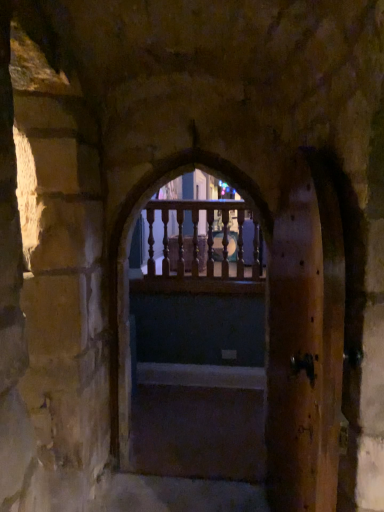
What do you see at coordinates (200, 234) in the screenshot?
I see `transparent wooden railing at center` at bounding box center [200, 234].

The height and width of the screenshot is (512, 384). What do you see at coordinates (198, 422) in the screenshot? I see `dark wood stairs at center` at bounding box center [198, 422].

What is the approximate width of brown wooden screen door at right?

It is 10.09 inches.

Identify the location of brown wooden screen door at right. (305, 342).

Where is `transparent wooden railing at center`? The image size is (384, 512). transparent wooden railing at center is located at coordinates (200, 234).

From the image's perspective, is wooden railing at center located above or below dark wood stairs at center?

Clearly, from the image's perspective, wooden railing at center is above dark wood stairs at center.

Between wooden railing at center and dark wood stairs at center, which one has less height?

dark wood stairs at center.

Is point (160, 440) closer or farther from the camera than point (244, 429)?

Point (160, 440) appears to be closer to the viewer than point (244, 429).

Looking at this image, considering the sizes of objects wooden railing at center and dark wood stairs at center in the image provided, who is wider, wooden railing at center or dark wood stairs at center?

dark wood stairs at center.

Which is behind, transparent wooden railing at center or brown wooden screen door at right?

transparent wooden railing at center is further from the camera.

Can you tell me how much transparent wooden railing at center and brown wooden screen door at right differ in facing direction?

The angular difference between transparent wooden railing at center and brown wooden screen door at right is 85 degrees.

From the picture: Can you confirm if transparent wooden railing at center is thinner than brown wooden screen door at right?

Correct, the width of transparent wooden railing at center is less than that of brown wooden screen door at right.

From the image's perspective, is transparent wooden railing at center under brown wooden screen door at right?

Actually, transparent wooden railing at center appears above brown wooden screen door at right in the image.

Is dark wood stairs at center inside or outside of wooden railing at center?

The correct answer is: outside.

The width and height of the screenshot is (384, 512). Find the location of `stairs behind the wooden railing at center`. stairs behind the wooden railing at center is located at coordinates (198, 422).

Is dark wood stairs at center not near wooden railing at center?

No, dark wood stairs at center is not far away from wooden railing at center.

Is dark wood stairs at center positioned with its back to wooden railing at center?

dark wood stairs at center does not have its back to wooden railing at center.

Is wooden railing at center completely or partially inside transparent wooden railing at center?

No, wooden railing at center is not inside transparent wooden railing at center.

Between transparent wooden railing at center and wooden railing at center, which one has larger width?

Wider between the two is wooden railing at center.

Is transparent wooden railing at center oriented away from wooden railing at center?

No, transparent wooden railing at center is not facing the opposite direction of wooden railing at center.

I want to click on glass window lying on the left of wooden railing at center, so click(x=200, y=234).

Is transparent wooden railing at center at the back of brown wooden screen door at right?

No.

From the image's perspective, between brown wooden screen door at right and transparent wooden railing at center, which one is located above?

From the image's view, transparent wooden railing at center is above.

Between brown wooden screen door at right and transparent wooden railing at center, which one has smaller width?

transparent wooden railing at center is thinner.

Is brown wooden screen door at right with transparent wooden railing at center?

No, brown wooden screen door at right is not next to transparent wooden railing at center.

From a real-world perspective, is brown wooden screen door at right over wooden railing at center?

No.

Considering the sizes of brown wooden screen door at right and wooden railing at center in the image, is brown wooden screen door at right taller or shorter than wooden railing at center?

brown wooden screen door at right is shorter than wooden railing at center.

Which object is closer to the camera, brown wooden screen door at right or wooden railing at center?

Positioned in front is brown wooden screen door at right.

In the scene shown: How different are the orientations of brown wooden screen door at right and wooden railing at center in degrees?

brown wooden screen door at right and wooden railing at center are facing 82.7 degrees away from each other.

Which is closer to the camera, (205, 230) or (162, 373)?

The point (205, 230) is closer to the camera.

Are transparent wooden railing at center and dark wood stairs at center located far from each other?

Indeed, transparent wooden railing at center is not near dark wood stairs at center.

Considering the sizes of transparent wooden railing at center and dark wood stairs at center in the image, is transparent wooden railing at center taller or shorter than dark wood stairs at center?

Considering their sizes, transparent wooden railing at center has more height than dark wood stairs at center.

Considering the sizes of objects transparent wooden railing at center and dark wood stairs at center in the image provided, who is smaller, transparent wooden railing at center or dark wood stairs at center?

With smaller size is dark wood stairs at center.

Where is `stairs below the wooden railing at center (from the image's perspective)`? stairs below the wooden railing at center (from the image's perspective) is located at coordinates (198, 422).

This screenshot has height=512, width=384. I want to click on screen door that is on the right side of transparent wooden railing at center, so click(305, 342).

Which object lies further to the anchor point dark wood stairs at center, wooden railing at center or transparent wooden railing at center?

transparent wooden railing at center lies further to dark wood stairs at center than the other object.

When comparing their distances from brown wooden screen door at right, does wooden railing at center or transparent wooden railing at center seem further?

The object further to brown wooden screen door at right is transparent wooden railing at center.

Based on their spatial positions, is transparent wooden railing at center or wooden railing at center closer to brown wooden screen door at right?

wooden railing at center lies closer to brown wooden screen door at right than the other object.

Estimate the real-world distances between objects in this image. Which object is closer to transparent wooden railing at center, wooden railing at center or brown wooden screen door at right?

Among the two, wooden railing at center is located nearer to transparent wooden railing at center.

When comparing their distances from dark wood stairs at center, does brown wooden screen door at right or wooden railing at center seem closer?

Based on the image, wooden railing at center appears to be nearer to dark wood stairs at center.

Based on their spatial positions, is transparent wooden railing at center or dark wood stairs at center further from brown wooden screen door at right?

The object further to brown wooden screen door at right is transparent wooden railing at center.

Estimate the real-world distances between objects in this image. Which object is further from brown wooden screen door at right, wooden railing at center or dark wood stairs at center?

wooden railing at center is further to brown wooden screen door at right.

From the image, which object appears to be nearer to dark wood stairs at center, brown wooden screen door at right or transparent wooden railing at center?

transparent wooden railing at center is closer to dark wood stairs at center.

Where is `stairs between wooden railing at center and transparent wooden railing at center from front to back`? Image resolution: width=384 pixels, height=512 pixels. stairs between wooden railing at center and transparent wooden railing at center from front to back is located at coordinates (198, 422).

The image size is (384, 512). Identify the location of window frame between brown wooden screen door at right and transparent wooden railing at center in the front-back direction. (197, 348).

The height and width of the screenshot is (512, 384). Find the location of `stairs located between brown wooden screen door at right and transparent wooden railing at center in the depth direction`. stairs located between brown wooden screen door at right and transparent wooden railing at center in the depth direction is located at coordinates (198, 422).

You are a GUI agent. You are given a task and a screenshot of the screen. Output one action in this format:
    pyautogui.click(x=<x>, y=<y>)
    Task: Click on the window frame located between brown wooden screen door at right and dark wood stairs at center in the depth direction
    The width and height of the screenshot is (384, 512).
    Given the screenshot: What is the action you would take?
    pyautogui.click(x=197, y=348)